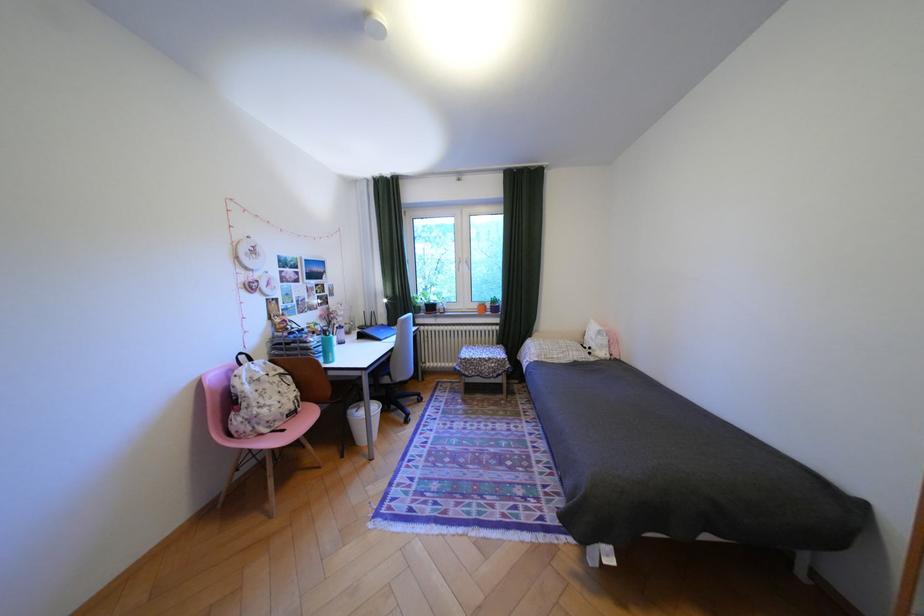
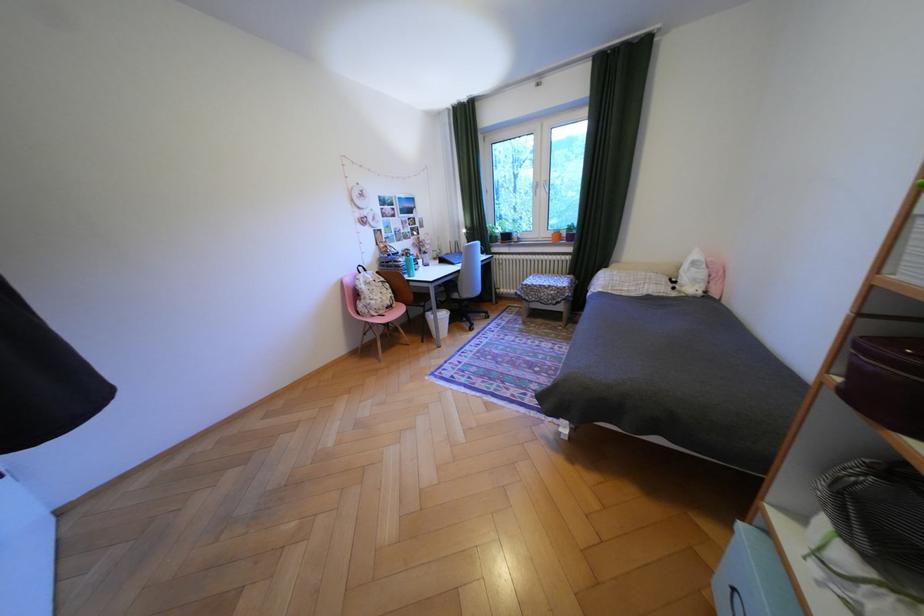
Question: The camera is either moving clockwise (left) or counter-clockwise (right) around the object. The first image is from the beginning of the video and the second image is from the end. Is the camera moving left or right when shooting the video?

Choices:
 (A) Left
 (B) Right

Answer: (B)